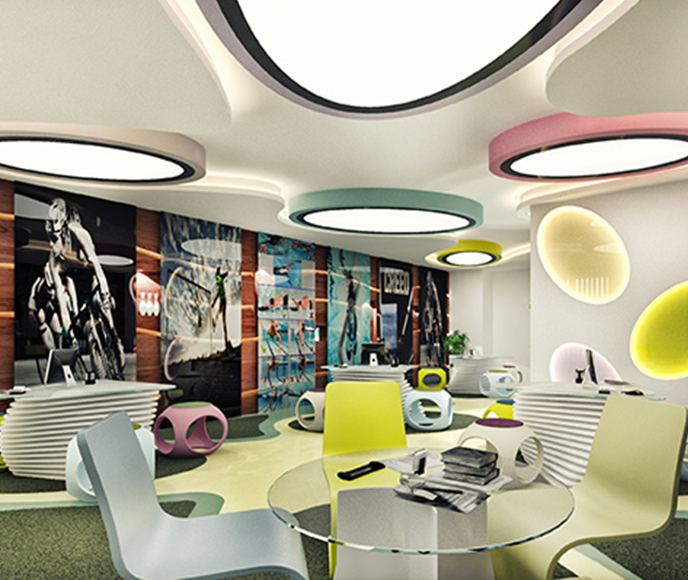
Image resolution: width=688 pixels, height=580 pixels. In order to click on stool in this screenshot , I will do `click(513, 445)`, `click(439, 408)`, `click(296, 408)`, `click(420, 376)`, `click(497, 389)`, `click(519, 369)`, `click(192, 420)`, `click(73, 469)`.